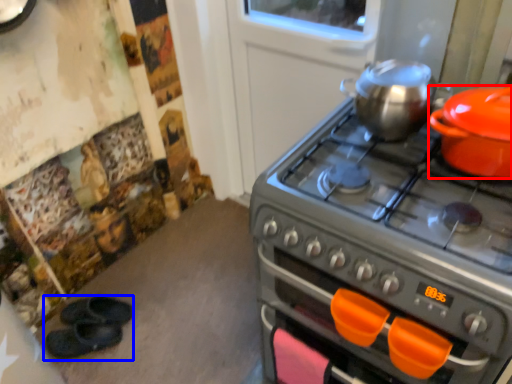
Question: Which object is further to the camera taking this photo, kitchen appliance (highlighted by a red box) or footwear (highlighted by a blue box)?

Choices:
 (A) kitchen appliance
 (B) footwear

Answer: (B)